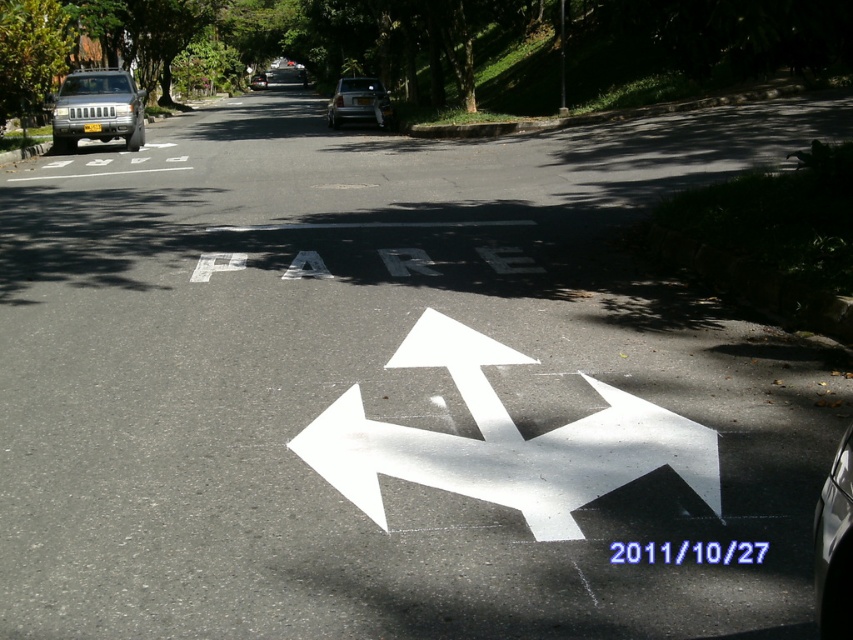
Measure the distance between glossy silver car at lower right and white glossy car at center.

glossy silver car at lower right and white glossy car at center are 27.30 meters apart.

Does glossy silver car at lower right have a lesser width compared to white glossy car at center?

Indeed, glossy silver car at lower right has a lesser width compared to white glossy car at center.

Where is `glossy silver car at lower right`? The height and width of the screenshot is (640, 853). glossy silver car at lower right is located at coordinates (834, 547).

Is matte silver suv at left further to the viewer compared to white glossy car at center?

That is False.

Which is behind, point (119, 83) or point (369, 113)?

The point (369, 113) is behind.

Where is `matte silver suv at left`? The width and height of the screenshot is (853, 640). matte silver suv at left is located at coordinates (97, 109).

Is white glossy car at center positioned before silver metallic car at center?

Yes, it is.

Does white glossy car at center have a smaller size compared to silver metallic car at center?

Incorrect, white glossy car at center is not smaller in size than silver metallic car at center.

Where is `white glossy car at center`? white glossy car at center is located at coordinates (358, 102).

Where is `white glossy car at center`? white glossy car at center is located at coordinates (358, 102).